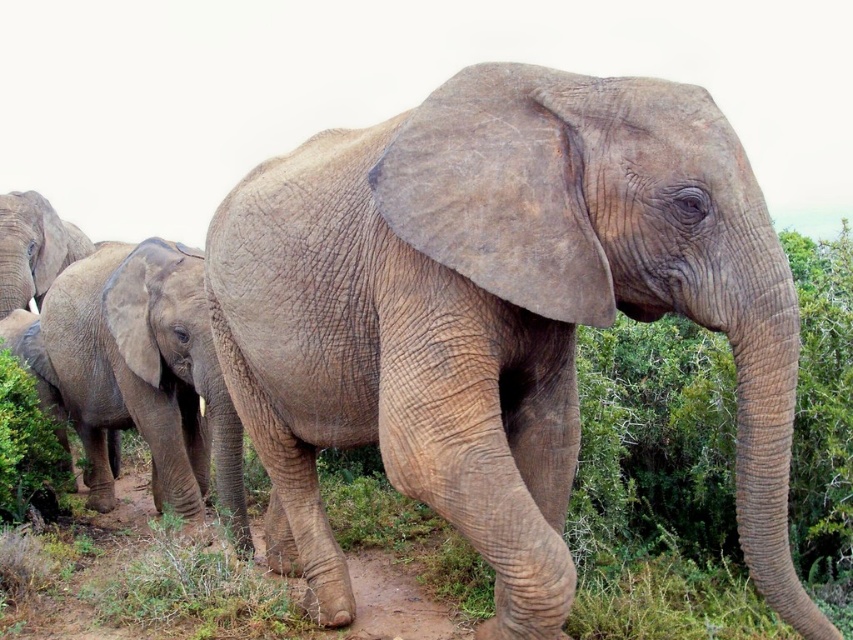
Question: Which object appears farthest from the camera in this image?

Choices:
 (A) gray textured elephant at upper left
 (B) gray textured baby elephant at lower left

Answer: (A)

Question: Which object is closer to the camera taking this photo?

Choices:
 (A) gray textured baby elephant at lower left
 (B) gray textured elephant at center
 (C) gray textured elephant at upper left

Answer: (B)

Question: Which of these objects is positioned closest to the gray textured elephant at center?

Choices:
 (A) gray textured baby elephant at lower left
 (B) gray textured elephant at upper left

Answer: (A)

Question: Observing the image, what is the correct spatial positioning of gray textured elephant at center in reference to gray textured elephant at upper left?

Choices:
 (A) left
 (B) right

Answer: (B)

Question: Does gray textured baby elephant at lower left have a smaller size compared to gray textured elephant at upper left?

Choices:
 (A) no
 (B) yes

Answer: (A)

Question: Is gray textured elephant at center below gray textured baby elephant at lower left?

Choices:
 (A) yes
 (B) no

Answer: (B)